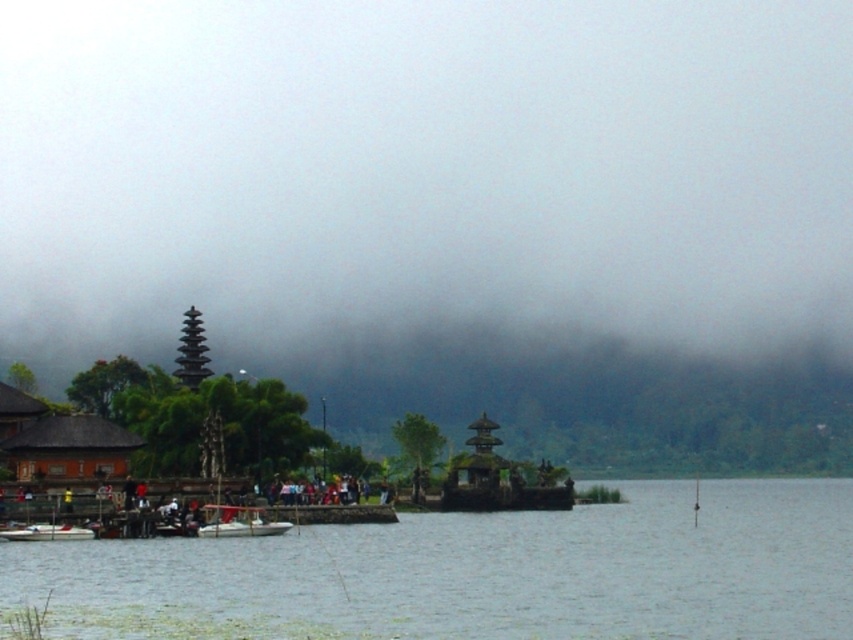
You are a visitor at the lakeside and want to board the closest white plastic boat. Which boat should you approach, the white plastic boat at center or the white plastic boat at lower left?

You should approach the white plastic boat at center because it is closer to you than the white plastic boat at lower left.

You are a fisherman standing on the dock and want to reach the white plastic boat at center from the clear water at center. Can you walk directly to the boat without getting wet?

The clear water at center and white plastic boat at center are 67.05 feet apart from each other, so you can walk directly to the boat without getting wet since the distance is too far to swim but there might be a path on land.

You are a photographer trying to capture the traditional structure on the left and the group of people in the middle ground. Since the foggy atmosphere at center might obstruct your view, where exactly is the fog located in relation to these two subjects?

The foggy atmosphere at center is located at point 0.333 on the x axis and 0.530 on the y axis, which places it centrally between the traditional structure on the left and the group of people in the middle ground, potentially obscuring both subjects equally.